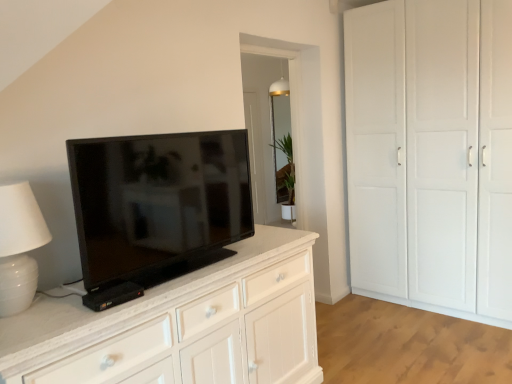
Question: Considering the positions of white ceramic table lamp at left and green matte plant at center in the image, is white ceramic table lamp at left taller or shorter than green matte plant at center?

Choices:
 (A) tall
 (B) short

Answer: (B)

Question: In the image, is white ceramic table lamp at left positioned in front of or behind green matte plant at center?

Choices:
 (A) front
 (B) behind

Answer: (A)

Question: Based on their relative distances, which object is farther from the white matte cupboard at right?

Choices:
 (A) green matte plant at center
 (B) black glossy tv at center
 (C) white ceramic table lamp at left

Answer: (C)

Question: Which object is positioned closest to the green matte plant at center?

Choices:
 (A) black glossy tv at center
 (B) white matte cupboard at right
 (C) white ceramic table lamp at left

Answer: (B)